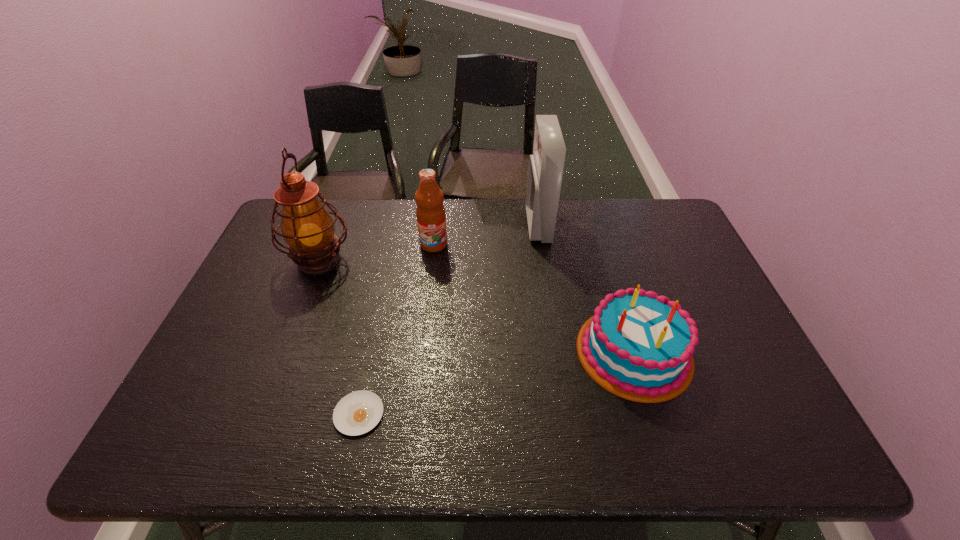
Where is `oil lamp`? oil lamp is located at coordinates 307,227.

You are a GUI agent. You are given a task and a screenshot of the screen. Output one action in this format:
    pyautogui.click(x=<x>, y=<y>)
    Task: Click on the fourth object from left to right
    
    Given the screenshot: What is the action you would take?
    pyautogui.click(x=546, y=165)

Identify the location of the third object from left to right. This screenshot has height=540, width=960. (431, 218).

At what (x,y) coordinates should I click in order to perform the action: click on fruit juice. Please return your answer as a coordinate pair (x, y). Looking at the image, I should click on (431, 218).

Image resolution: width=960 pixels, height=540 pixels. In order to click on birthday cake in this screenshot , I will do `click(637, 344)`.

I want to click on the fourth tallest object, so click(637, 344).

The height and width of the screenshot is (540, 960). In order to click on the shortest object in this screenshot , I will do `click(357, 413)`.

The width and height of the screenshot is (960, 540). Identify the location of egg yolk. (357, 413).

Find the location of a particular element. free region located 0.330m on the front of the oil lamp is located at coordinates (271, 383).

This screenshot has height=540, width=960. I want to click on vacant position located 0.130m on the front-facing side of the second object from right to left, so click(489, 226).